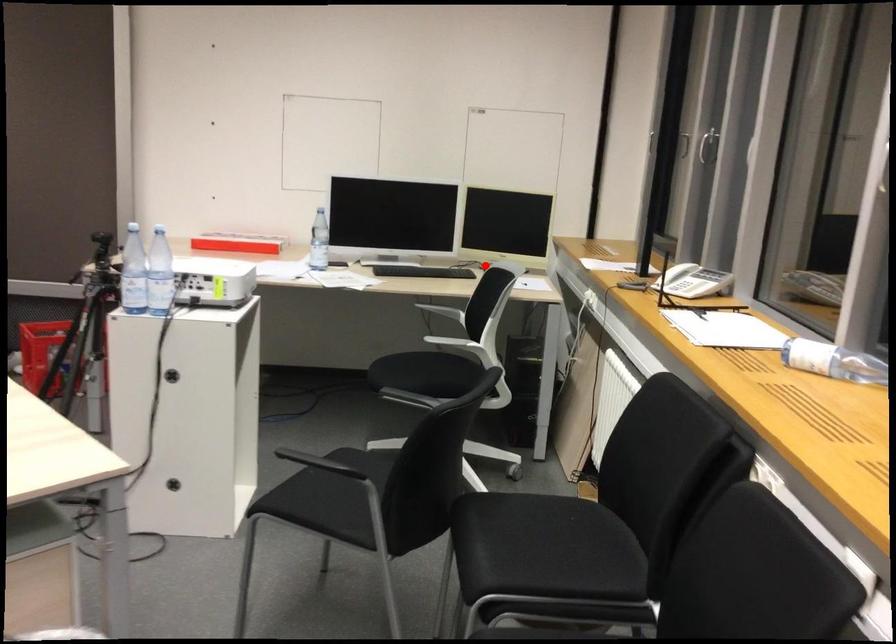
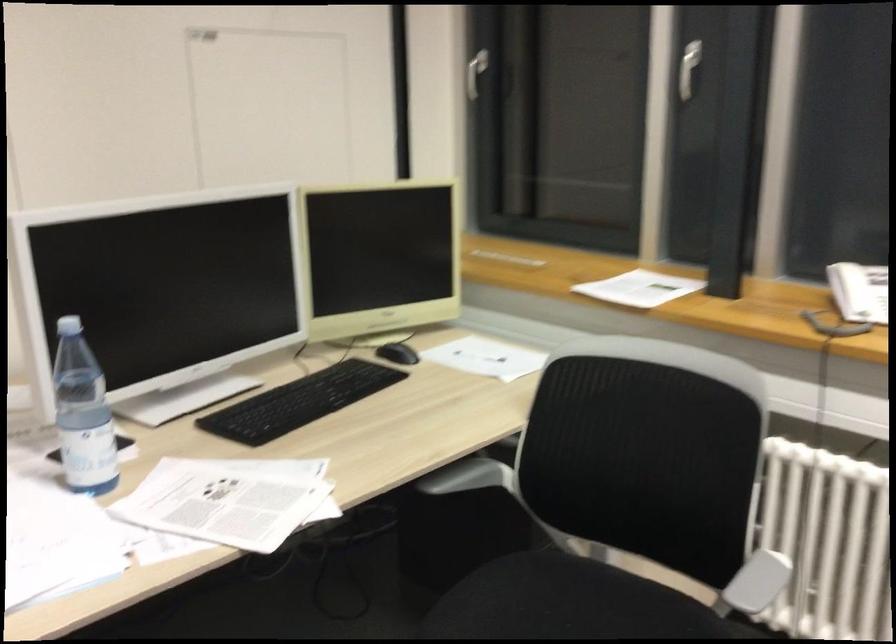
Question: I am providing you with two images of the same scene from different viewpoints. Image1 has a red point marked. In image2, the corresponding 3D location appears at what relative position? Reply with the corresponding letter.

Choices:
 (A) Closer
 (B) Farther

Answer: (A)